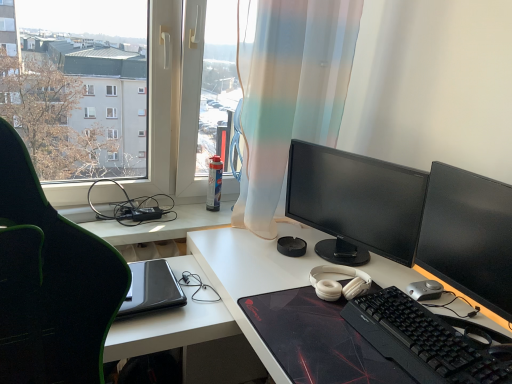
Where is `free space between matte black monitor at center, positioned as the 2th computer monitor in front-to-back order, and silver metallic mouse at lower right`? free space between matte black monitor at center, positioned as the 2th computer monitor in front-to-back order, and silver metallic mouse at lower right is located at coordinates (422, 282).